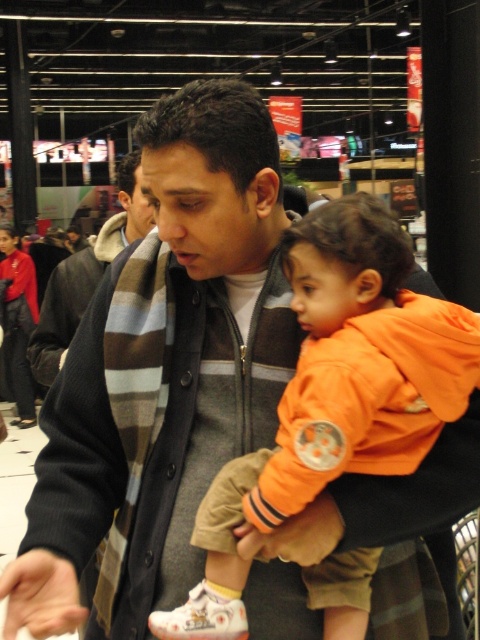
Does orange fleece jacket at center have a lesser width compared to striped wool scarf at center?

Yes.

Is orange fleece jacket at center taller than striped wool scarf at center?

In fact, orange fleece jacket at center may be shorter than striped wool scarf at center.

Locate an element on the screen. This screenshot has width=480, height=640. orange fleece jacket at center is located at coordinates (336, 394).